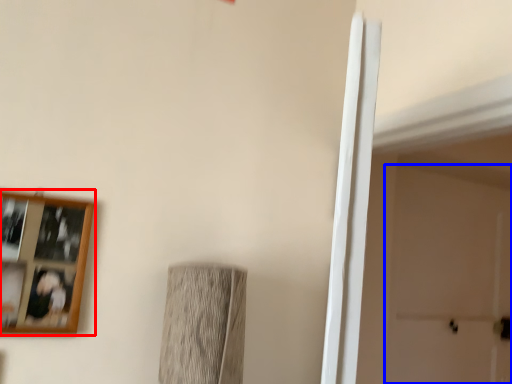
Question: Which point is further to the camera, picture frame (highlighted by a red box) or door (highlighted by a blue box)?

Choices:
 (A) picture frame
 (B) door

Answer: (B)